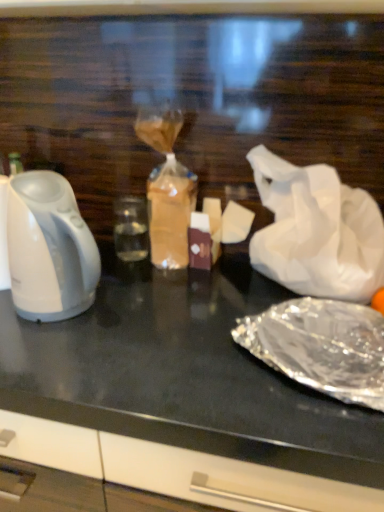
The height and width of the screenshot is (512, 384). What are the coordinates of `vacant space in front of white glossy kettle at left` in the screenshot? It's located at (51, 372).